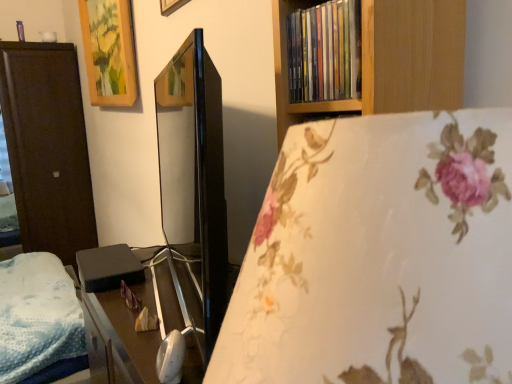
What do you see at coordinates (324, 52) in the screenshot?
I see `multicolored plastic books at upper right` at bounding box center [324, 52].

Describe the element at coordinates (109, 51) in the screenshot. The width and height of the screenshot is (512, 384). I see `wooden picture frame at upper left` at that location.

The height and width of the screenshot is (384, 512). What do you see at coordinates (108, 268) in the screenshot? I see `black matte/black box at left` at bounding box center [108, 268].

The height and width of the screenshot is (384, 512). I want to click on multicolored plastic books at upper right, so click(x=324, y=52).

Between black matte/black box at left and black glossy table at center, which one has smaller width?

black matte/black box at left is thinner.

Could you tell me if black matte/black box at left is facing black glossy table at center?

No, black matte/black box at left is not turned towards black glossy table at center.

Is black matte/black box at left in contact with black glossy table at center?

There is a gap between black matte/black box at left and black glossy table at center.

From the image's perspective, which object appears higher, black matte/black box at left or dark wood wardrobe at left?

From the image's view, dark wood wardrobe at left is above.

Is black matte/black box at left wider or thinner than dark wood wardrobe at left?

In the image, black matte/black box at left appears to be more narrow than dark wood wardrobe at left.

Is black matte/black box at left oriented away from dark wood wardrobe at left?

No, dark wood wardrobe at left is not at the back of black matte/black box at left.

Would you say black matte/black box at left is outside dark wood wardrobe at left?

That's correct, black matte/black box at left is outside of dark wood wardrobe at left.

Is black glossy table at center oriented towards wooden picture frame at upper left?

No, black glossy table at center does not turn towards wooden picture frame at upper left.

From the image's perspective, between black glossy table at center and wooden picture frame at upper left, who is located below?

black glossy table at center.

Considering the relative sizes of black glossy table at center and wooden picture frame at upper left in the image provided, is black glossy table at center smaller than wooden picture frame at upper left?

No.

Which object is wider, black glossy table at center or wooden picture frame at upper left?

Wider between the two is black glossy table at center.

Measure the distance from dark wood wardrobe at left to black glossy table at center.

A distance of 8.21 feet exists between dark wood wardrobe at left and black glossy table at center.

What's the angular difference between dark wood wardrobe at left and black glossy table at center's facing directions?

The facing directions of dark wood wardrobe at left and black glossy table at center are 87.7 degrees apart.

Are dark wood wardrobe at left and black glossy table at center located far from each other?

Absolutely, dark wood wardrobe at left is distant from black glossy table at center.

Does dark wood wardrobe at left turn towards black glossy table at center?

Yes, dark wood wardrobe at left is oriented towards black glossy table at center.

In the scene shown: Is multicolored plastic books at upper right at the right side of black matte/black box at left?

Correct, you'll find multicolored plastic books at upper right to the right of black matte/black box at left.

Based on the photo, how different are the orientations of multicolored plastic books at upper right and black matte/black box at left in degrees?

multicolored plastic books at upper right and black matte/black box at left are facing 3.63 degrees away from each other.

Measure the distance from multicolored plastic books at upper right to black matte/black box at left.

The distance of multicolored plastic books at upper right from black matte/black box at left is 34.33 inches.

Identify the location of paperback book that is under the multicolored plastic books at upper right (from a real-world perspective). (108, 268).

Choose the correct answer: Is black matte/black box at left inside wooden picture frame at upper left or outside it?

black matte/black box at left is not inside wooden picture frame at upper left, it's outside.

Consider the image. Between black matte/black box at left and wooden picture frame at upper left, which one appears on the left side from the viewer's perspective?

Positioned to the left is wooden picture frame at upper left.

In the image, is black matte/black box at left positioned in front of or behind wooden picture frame at upper left?

black matte/black box at left is in front of wooden picture frame at upper left.

Is multicolored plastic books at upper right at the back of black glossy table at center?

No, black glossy table at center's orientation is not away from multicolored plastic books at upper right.

Identify the location of table that appears below the multicolored plastic books at upper right (from the image's perspective). (137, 314).

Is black glossy table at center shorter than multicolored plastic books at upper right?

In fact, black glossy table at center may be taller than multicolored plastic books at upper right.

Is black glossy table at center located outside multicolored plastic books at upper right?

Indeed, black glossy table at center is completely outside multicolored plastic books at upper right.

The height and width of the screenshot is (384, 512). I want to click on table in front of the black matte/black box at left, so click(137, 314).

The width and height of the screenshot is (512, 384). What are the coordinates of `paperback book below the dark wood wardrobe at left (from the image's perspective)` in the screenshot? It's located at (108, 268).

In the scene shown: Looking at the image, which one is located further to black matte/black box at left, wooden picture frame at upper left or black glossy table at center?

Among the two, wooden picture frame at upper left is located further to black matte/black box at left.

Estimate the real-world distances between objects in this image. Which object is closer to black glossy table at center, black matte/black box at left or multicolored plastic books at upper right?

black matte/black box at left.

Estimate the real-world distances between objects in this image. Which object is further from multicolored plastic books at upper right, dark wood wardrobe at left or wooden picture frame at upper left?

Among the two, dark wood wardrobe at left is located further to multicolored plastic books at upper right.

Looking at the image, which one is located further to wooden picture frame at upper left, multicolored plastic books at upper right or dark wood wardrobe at left?

multicolored plastic books at upper right is further to wooden picture frame at upper left.

From the picture: Based on their spatial positions, is wooden picture frame at upper left or multicolored plastic books at upper right closer to black matte/black box at left?

multicolored plastic books at upper right is positioned closer to the anchor black matte/black box at left.

From the image, which object appears to be farther from multicolored plastic books at upper right, dark wood wardrobe at left or black matte/black box at left?

dark wood wardrobe at left lies further to multicolored plastic books at upper right than the other object.

In the scene shown: Which object lies nearer to the anchor point wooden picture frame at upper left, multicolored plastic books at upper right or black glossy table at center?

Based on the image, black glossy table at center appears to be nearer to wooden picture frame at upper left.

When comparing their distances from black glossy table at center, does black matte/black box at left or wooden picture frame at upper left seem closer?

black matte/black box at left.

The image size is (512, 384). I want to click on table between multicolored plastic books at upper right and wooden picture frame at upper left from front to back, so click(x=137, y=314).

This screenshot has height=384, width=512. Identify the location of paperback book that lies between multicolored plastic books at upper right and black glossy table at center from top to bottom. (108, 268).

At what (x,y) coordinates should I click in order to perform the action: click on picture frame between black glossy table at center and dark wood wardrobe at left from front to back. Please return your answer as a coordinate pair (x, y). This screenshot has width=512, height=384. Looking at the image, I should click on (109, 51).

Find the location of a particular element. This screenshot has width=512, height=384. paperback book between multicolored plastic books at upper right and dark wood wardrobe at left along the z-axis is located at coordinates (108, 268).